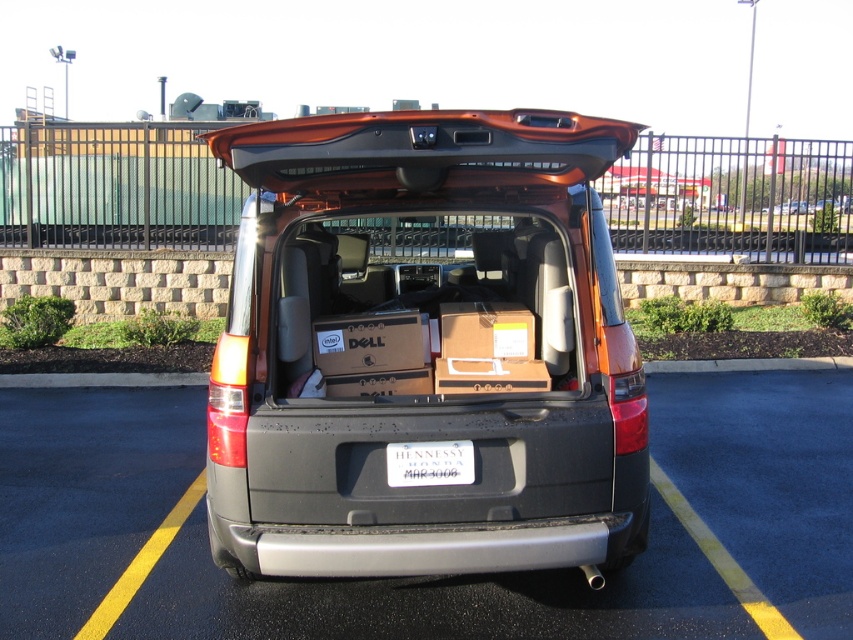
Between metallic orange suv at center and black plastic car at center, which one is positioned higher?

metallic orange suv at center

Is metallic orange suv at center behind black plastic car at center?

That is False.

This screenshot has width=853, height=640. What do you see at coordinates (430, 348) in the screenshot? I see `metallic orange suv at center` at bounding box center [430, 348].

You are a GUI agent. You are given a task and a screenshot of the screen. Output one action in this format:
    pyautogui.click(x=<x>, y=<y>)
    Task: Click on the metallic orange suv at center
    Image resolution: width=853 pixels, height=640 pixels.
    Given the screenshot: What is the action you would take?
    pyautogui.click(x=430, y=348)

In the scene shown: Between metallic orange suv at center and matte brown cardboard box at center, which one has more height?

metallic orange suv at center is taller.

Does metallic orange suv at center have a larger size compared to matte brown cardboard box at center?

Yes.

This screenshot has width=853, height=640. I want to click on metallic orange suv at center, so click(430, 348).

In the scene shown: Is metallic orange suv at center to the left of white plastic license plate at center from the viewer's perspective?

Yes, metallic orange suv at center is to the left of white plastic license plate at center.

Does metallic orange suv at center have a lesser width compared to white plastic license plate at center?

In fact, metallic orange suv at center might be wider than white plastic license plate at center.

Which is in front, point (581, 525) or point (415, 470)?

Point (581, 525)

Find the location of a particular element. This screenshot has height=640, width=853. metallic orange suv at center is located at coordinates (430, 348).